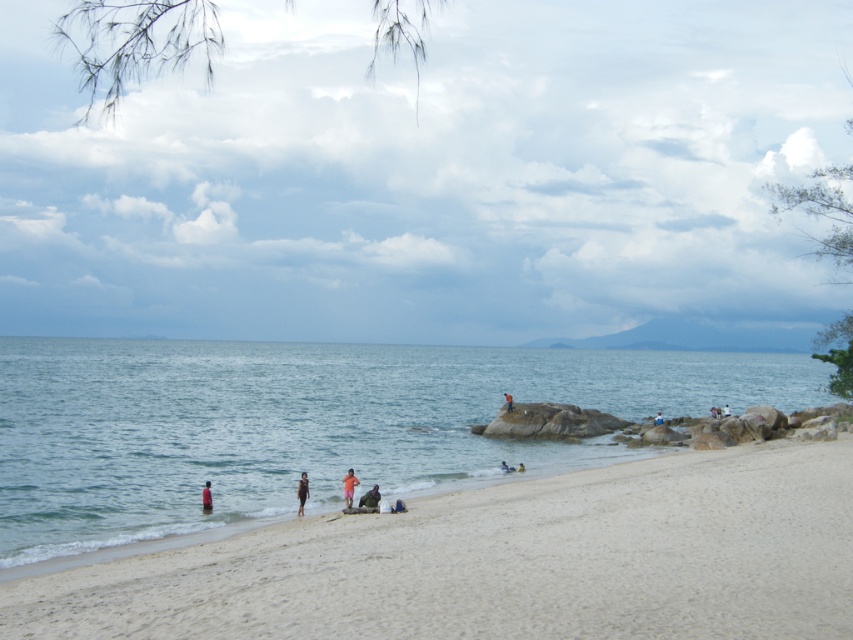
Question: Is dark brown fabric bag at center above light brown wooden stick at center?

Choices:
 (A) no
 (B) yes

Answer: (B)

Question: Which object appears farthest from the camera in this image?

Choices:
 (A) orange fabric person at center
 (B) dark blue fabric person at center

Answer: (B)

Question: Among these objects, which one is farthest from the camera?

Choices:
 (A) smooth yellow swimmer at center
 (B) light brown wooden stick at center
 (C) orange fabric person at center
 (D) dark brown fabric bag at center

Answer: (B)

Question: Does orange fabric person at center have a greater width compared to blue fabric shorts at center?

Choices:
 (A) no
 (B) yes

Answer: (A)

Question: Does white sandy beach at lower center have a greater width compared to blue fabric shorts at center?

Choices:
 (A) yes
 (B) no

Answer: (A)

Question: Which object is the closest to the smooth yellow swimmer at center?

Choices:
 (A) black matte swimsuit at center
 (B) dark brown fabric bag at center
 (C) white sandy beach at lower center

Answer: (A)